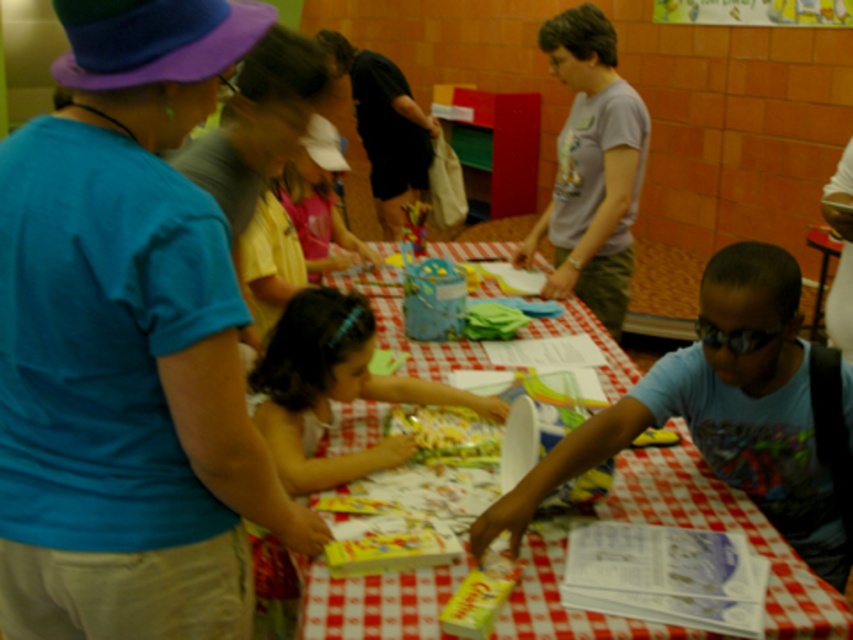
Which is below, blue cotton shirt at left or yellow fabric at center?

blue cotton shirt at left is below.

Does blue cotton shirt at left appear under yellow fabric at center?

Correct, blue cotton shirt at left is located below yellow fabric at center.

Between point (97, 145) and point (328, 150), which one is positioned behind?

Point (328, 150)

Where is `blue cotton shirt at left`? Image resolution: width=853 pixels, height=640 pixels. blue cotton shirt at left is located at coordinates click(126, 344).

Is the position of blue cotton shirt at left more distant than that of gray cotton shirt at center?

No, blue cotton shirt at left is closer to the viewer.

Which is below, blue cotton shirt at left or gray cotton shirt at center?

Positioned lower is blue cotton shirt at left.

Which is in front, point (10, 276) or point (605, 38)?

Point (10, 276)

I want to click on blue cotton shirt at left, so click(x=126, y=344).

Between light brown hair at center and yellow fabric at center, which one has more height?

yellow fabric at center is taller.

Who is more forward, [312,384] or [347,236]?

Positioned in front is point [312,384].

Identify the location of light brown hair at center. The image size is (853, 640). (334, 388).